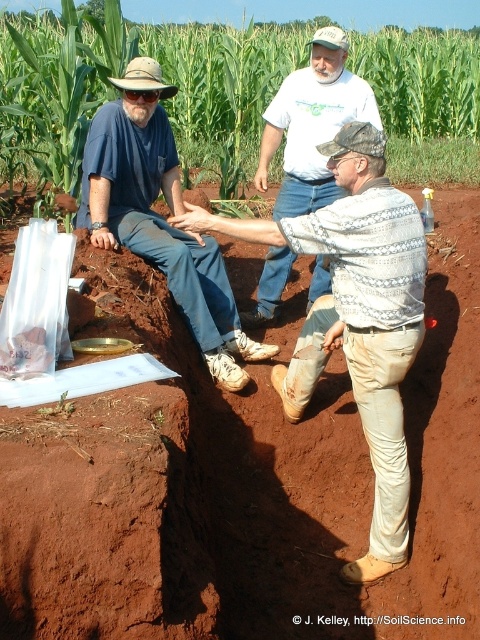
Which is below, matte blue jeans at left or white t-shirt at center?

matte blue jeans at left

Does matte blue jeans at left have a greater height compared to white t-shirt at center?

Correct, matte blue jeans at left is much taller as white t-shirt at center.

Identify the location of matte blue jeans at left. This screenshot has width=480, height=640. (159, 218).

Locate an element on the screen. matte blue jeans at left is located at coordinates (159, 218).

In the scene shown: Who is more distant from viewer, (x=372, y=131) or (x=284, y=173)?

The point (x=284, y=173) is behind.

Does worn beige pants at center appear over white t-shirt at center?

Incorrect, worn beige pants at center is not positioned above white t-shirt at center.

Is point (376, 442) less distant than point (294, 144)?

Yes, it is.

Identify the location of worn beige pants at center. (356, 316).

Does reddish-brown soil at center have a lesser height compared to worn beige pants at center?

Yes.

Describe the element at coordinates (243, 486) in the screenshot. The width and height of the screenshot is (480, 640). I see `reddish-brown soil at center` at that location.

Is point (214, 632) farther from viewer compared to point (395, 516)?

No, it is in front of (395, 516).

You are a GUI agent. You are given a task and a screenshot of the screen. Output one action in this format:
    pyautogui.click(x=<x>, y=<y>)
    Task: Click on the reddish-brown soil at center
    The image size is (480, 640).
    Given the screenshot: What is the action you would take?
    pyautogui.click(x=243, y=486)